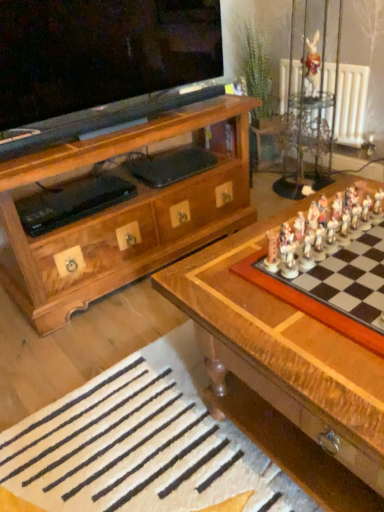
The width and height of the screenshot is (384, 512). Identify the location of free point below white wool rug at lower center (from a real-world perspective). (144, 439).